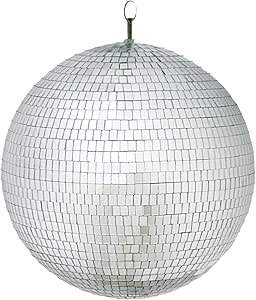
In order to click on disco ball in this screenshot , I will do `click(137, 170)`.